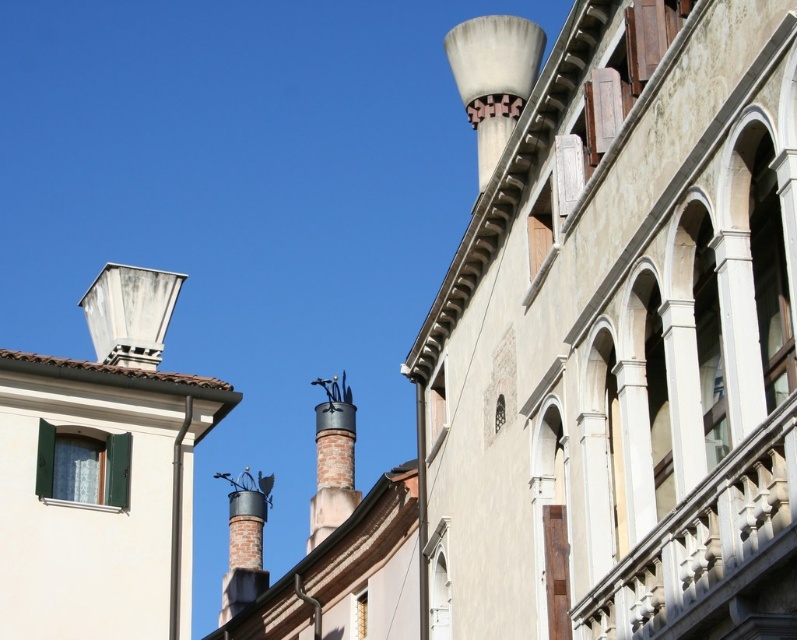
Question: Which of the following is the farthest from the observer?

Choices:
 (A) (328, 531)
 (B) (489, 145)
 (C) (151, 342)

Answer: (A)

Question: Is white matte chimney at upper right above white concrete chimney at upper left?

Choices:
 (A) no
 (B) yes

Answer: (B)

Question: Is white matte chimney at upper right closer to camera compared to white concrete chimney at upper left?

Choices:
 (A) no
 (B) yes

Answer: (B)

Question: Estimate the real-world distances between objects in this image. Which object is farther from the white matte chimney at upper right?

Choices:
 (A) white concrete chimney at upper left
 (B) polished metal chimney at center

Answer: (A)

Question: Does white matte chimney at upper right come in front of white concrete chimney at upper left?

Choices:
 (A) no
 (B) yes

Answer: (B)

Question: Which of the following is the farthest from the observer?

Choices:
 (A) (118, 362)
 (B) (468, 51)
 (C) (332, 496)

Answer: (C)